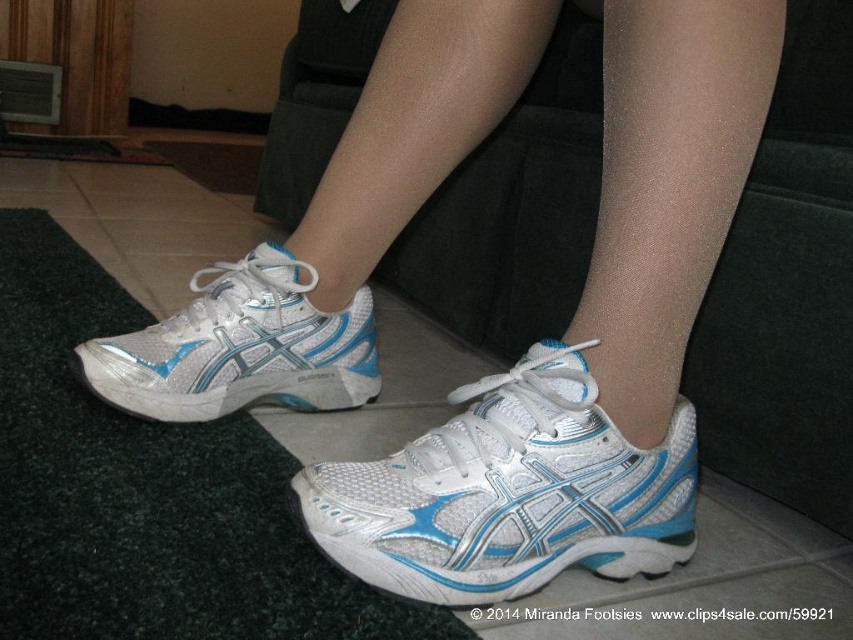
Is white mesh shoe at center thinner than white mesh shoe at left?

In fact, white mesh shoe at center might be wider than white mesh shoe at left.

Does white mesh shoe at center have a smaller size compared to white mesh shoe at left?

Correct, white mesh shoe at center occupies less space than white mesh shoe at left.

Who is more forward, [316,506] or [200,362]?

Point [316,506] is in front.

At what (x,y) coordinates should I click in order to perform the action: click on white mesh shoe at center. Please return your answer as a coordinate pair (x, y). This screenshot has width=853, height=640. Looking at the image, I should click on (509, 492).